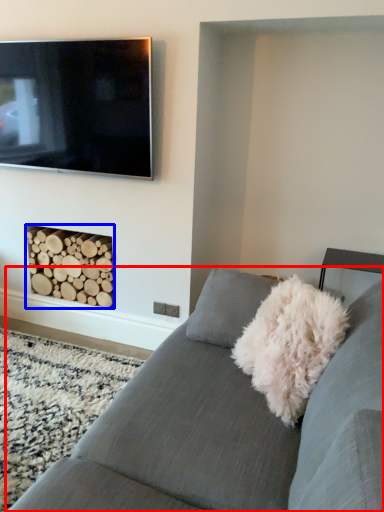
Question: Which of the following is the farthest to the observer, studio couch (highlighted by a red box) or fireplace (highlighted by a blue box)?

Choices:
 (A) studio couch
 (B) fireplace

Answer: (B)